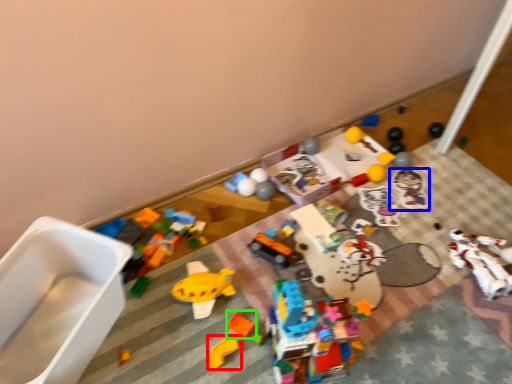
Question: Which object is the closest to the toy (highlighted by a red box)? Choose among these: toy (highlighted by a blue box) or toy (highlighted by a green box).

Choices:
 (A) toy
 (B) toy

Answer: (B)